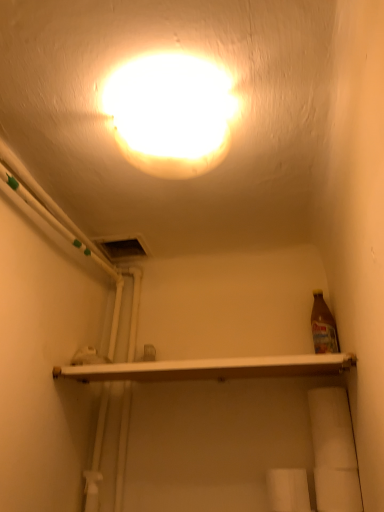
Question: From the image's perspective, is white matte toilet paper at lower right, which is the 2th toilet paper in left-to-right order, above white glossy shelf at center?

Choices:
 (A) no
 (B) yes

Answer: (A)

Question: Does white matte toilet paper at lower right, the first toilet paper from the right, have a lesser height compared to white glossy shelf at center?

Choices:
 (A) no
 (B) yes

Answer: (A)

Question: Is white glossy shelf at center a part of white matte toilet paper at lower right, the first toilet paper from the right?

Choices:
 (A) no
 (B) yes

Answer: (A)

Question: Could you tell me if white matte toilet paper at lower right, the first toilet paper from the right, is turned towards white glossy shelf at center?

Choices:
 (A) no
 (B) yes

Answer: (A)

Question: From the image's perspective, is white matte toilet paper at lower right, the first toilet paper from the right, under white glossy shelf at center?

Choices:
 (A) yes
 (B) no

Answer: (A)

Question: Is white matte toilet paper at lower right, which is the 2th toilet paper in left-to-right order, not close to white glossy shelf at center?

Choices:
 (A) no
 (B) yes

Answer: (A)

Question: Can you confirm if white matte toilet paper at lower right, which is the 2th toilet paper in left-to-right order, is taller than white matte toilet paper at lower center, which is the 1th toilet paper from left to right?

Choices:
 (A) yes
 (B) no

Answer: (B)

Question: Is white matte toilet paper at lower right, the first toilet paper from the right, wider than white matte toilet paper at lower center, positioned as the 2th toilet paper in right-to-left order?

Choices:
 (A) no
 (B) yes

Answer: (A)

Question: Is white matte toilet paper at lower right, which is the 2th toilet paper in left-to-right order, oriented towards white matte toilet paper at lower center, positioned as the 2th toilet paper in right-to-left order?

Choices:
 (A) yes
 (B) no

Answer: (B)

Question: Is white matte toilet paper at lower center, positioned as the 2th toilet paper in right-to-left order, at the back of white matte toilet paper at lower right, which is the 2th toilet paper in left-to-right order?

Choices:
 (A) yes
 (B) no

Answer: (B)

Question: Is white matte toilet paper at lower right, the first toilet paper from the right, far away from white matte toilet paper at lower center, which is the 1th toilet paper from left to right?

Choices:
 (A) no
 (B) yes

Answer: (A)

Question: From the image's perspective, is white matte toilet paper at lower right, the first toilet paper from the right, beneath white matte toilet paper at lower center, positioned as the 2th toilet paper in right-to-left order?

Choices:
 (A) no
 (B) yes

Answer: (A)

Question: From the image's perspective, is white matte toilet paper at lower right, the first toilet paper from the right, below matte white light at upper center?

Choices:
 (A) no
 (B) yes

Answer: (B)